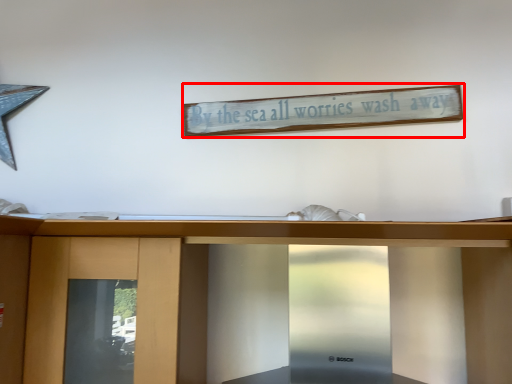
Question: From the image's perspective, what is the correct spatial relationship of bulletin board (annotated by the red box) in relation to furniture?

Choices:
 (A) below
 (B) above

Answer: (B)